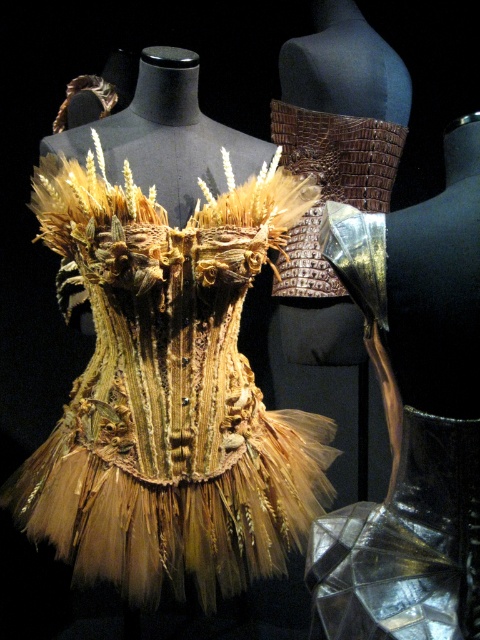
You are a fashion designer examining the displayed costumes. You notice the braided straw dress at center and the translucent tulle skirt at center. Which one appears closer to you in the image?

The braided straw dress at center appears closer to you because the translucent tulle skirt at center is positioned behind it.